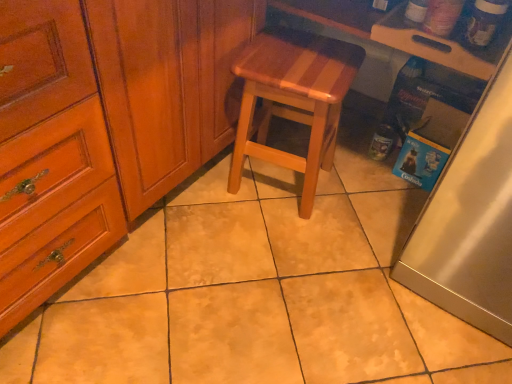
Question: Considering the relative sizes of satin silver fridge at right and natural wood stool at center in the image provided, is satin silver fridge at right wider than natural wood stool at center?

Choices:
 (A) no
 (B) yes

Answer: (B)

Question: From a real-world perspective, is satin silver fridge at right located beneath natural wood stool at center?

Choices:
 (A) yes
 (B) no

Answer: (B)

Question: Can you confirm if satin silver fridge at right is positioned to the left of natural wood stool at center?

Choices:
 (A) yes
 (B) no

Answer: (B)

Question: Is satin silver fridge at right taller than natural wood stool at center?

Choices:
 (A) no
 (B) yes

Answer: (B)

Question: Is satin silver fridge at right bigger than natural wood stool at center?

Choices:
 (A) yes
 (B) no

Answer: (A)

Question: From the image's perspective, is satin silver fridge at right located beneath natural wood stool at center?

Choices:
 (A) no
 (B) yes

Answer: (B)

Question: Does wooden cutting board at upper right have a larger size compared to natural wood stool at center?

Choices:
 (A) no
 (B) yes

Answer: (A)

Question: From the image's perspective, is wooden cutting board at upper right under natural wood stool at center?

Choices:
 (A) yes
 (B) no

Answer: (B)

Question: Is wooden cutting board at upper right thinner than natural wood stool at center?

Choices:
 (A) no
 (B) yes

Answer: (A)

Question: Is wooden cutting board at upper right far from natural wood stool at center?

Choices:
 (A) no
 (B) yes

Answer: (A)

Question: Can you confirm if wooden cutting board at upper right is taller than natural wood stool at center?

Choices:
 (A) no
 (B) yes

Answer: (A)

Question: Is wooden cutting board at upper right to the right of natural wood stool at center from the viewer's perspective?

Choices:
 (A) no
 (B) yes

Answer: (B)

Question: Considering the relative sizes of natural wood stool at center and satin silver fridge at right in the image provided, is natural wood stool at center bigger than satin silver fridge at right?

Choices:
 (A) no
 (B) yes

Answer: (A)